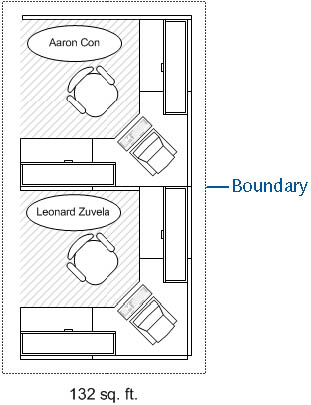
Identify the location of drawing of chairs. This screenshot has width=311, height=405. (87, 260), (94, 92).